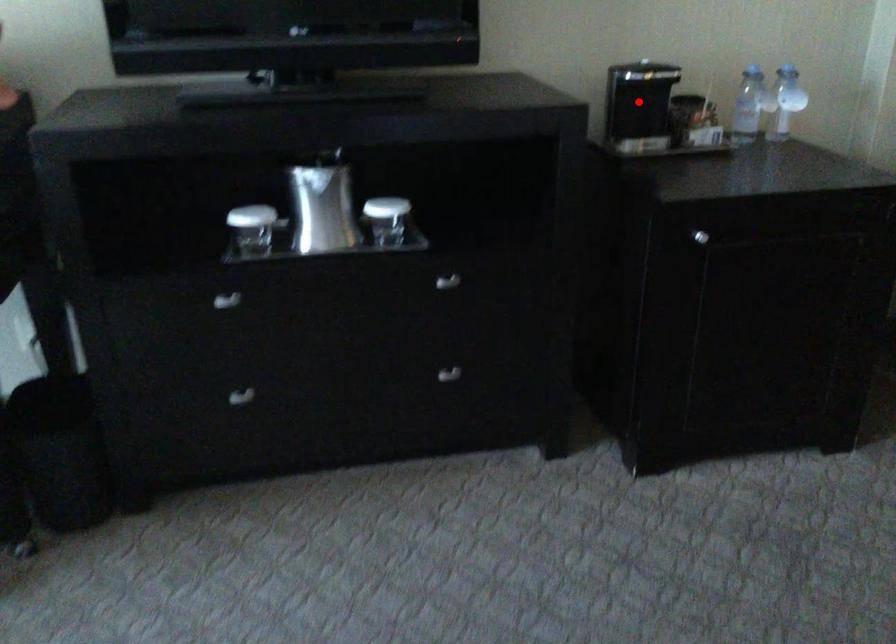
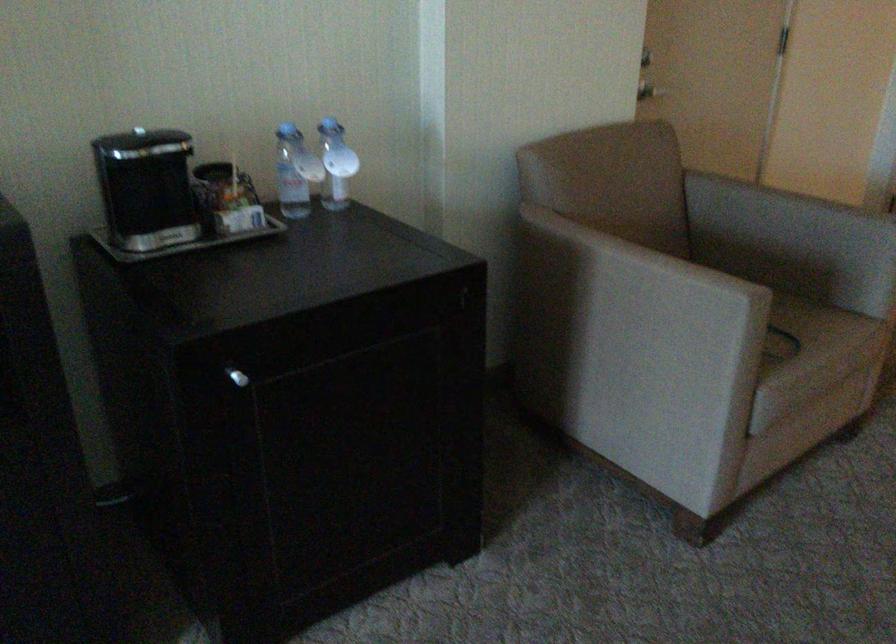
Locate, in the second image, the point that corresponds to the highlighted location in the first image.

(149, 194)